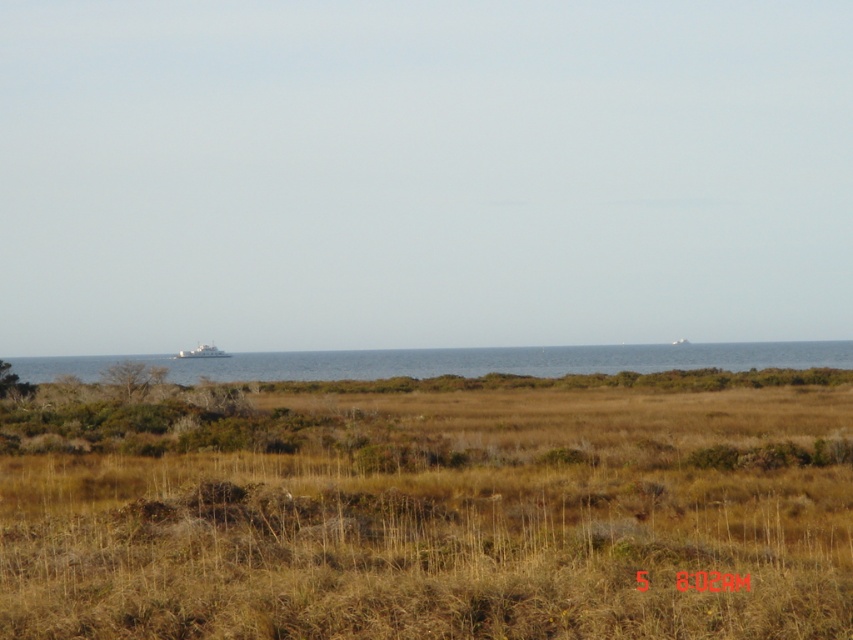
You are standing at the point with coordinates (x=456, y=362) in the coastal landscape. What is the immediate environment around you like?

The blue water at center is represented by point (x=456, y=362), so the immediate environment around you is blue water.

Based on the scene description, which object at center has a smaller size between the brown dry grass at center and the blue water at center?

The brown dry grass at center is smaller than the blue water at center according to the description.